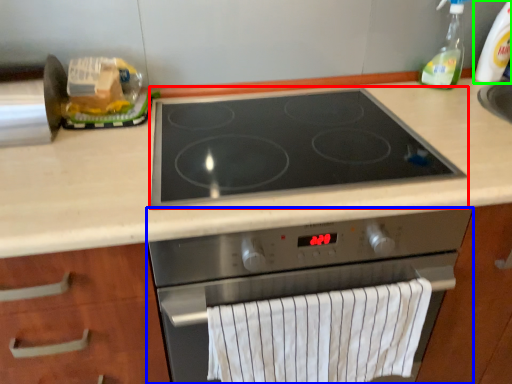
Question: Which is nearer to the gas stove (highlighted by a red box)? kitchen appliance (highlighted by a blue box) or bottle (highlighted by a green box).

Choices:
 (A) kitchen appliance
 (B) bottle

Answer: (A)